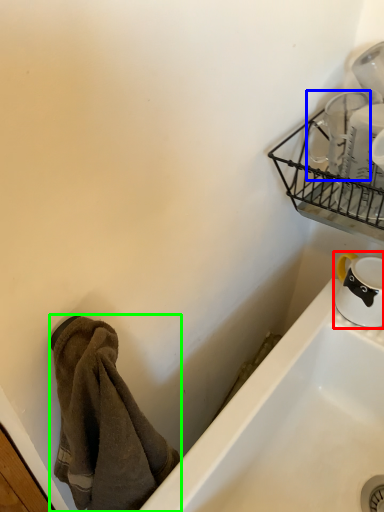
Question: Estimate the real-world distances between objects in this image. Which object is farther from tableware (highlighted by a red box), tableware (highlighted by a blue box) or towel/napkin (highlighted by a green box)?

Choices:
 (A) tableware
 (B) towel/napkin

Answer: (B)